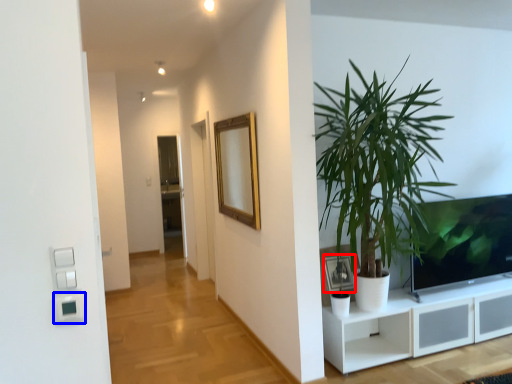
Question: Among these objects, which one is nearest to the camera, picture frame (highlighted by a red box) or light switch (highlighted by a blue box)?

Choices:
 (A) picture frame
 (B) light switch

Answer: (B)